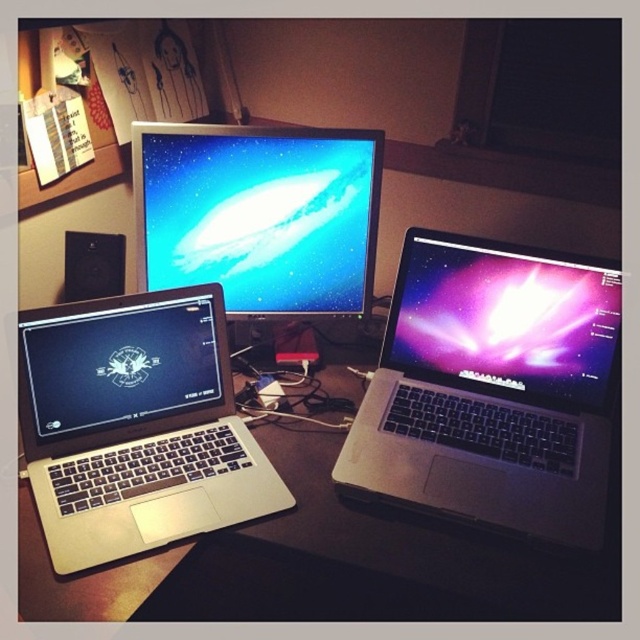
From the picture: Is matte black laptop at lower left thinner than black matte speaker at left?

No.

Does point (188, 401) lie in front of point (97, 241)?

Yes, it is in front of point (97, 241).

At what (x,y) coordinates should I click in order to perform the action: click on matte black laptop at lower left. Please return your answer as a coordinate pair (x, y). This screenshot has width=640, height=640. Looking at the image, I should click on (120, 368).

Who is positioned more to the right, silver metallic table at center or silver metallic laptop at left?

silver metallic table at center is more to the right.

Consider the image. Does silver metallic table at center have a lesser width compared to silver metallic laptop at left?

In fact, silver metallic table at center might be wider than silver metallic laptop at left.

Who is more forward, (65, 580) or (44, 348)?

Point (65, 580)

Locate an element on the screen. This screenshot has width=640, height=640. silver metallic table at center is located at coordinates (333, 560).

Is satin silver laptop at center thinner than matte plastic monitor at center?

In fact, satin silver laptop at center might be wider than matte plastic monitor at center.

Describe the element at coordinates (492, 387) in the screenshot. I see `satin silver laptop at center` at that location.

Is point (579, 432) closer to camera compared to point (218, 138)?

Yes, it is in front of point (218, 138).

Where is `satin silver laptop at center`? The image size is (640, 640). satin silver laptop at center is located at coordinates pyautogui.click(x=492, y=387).